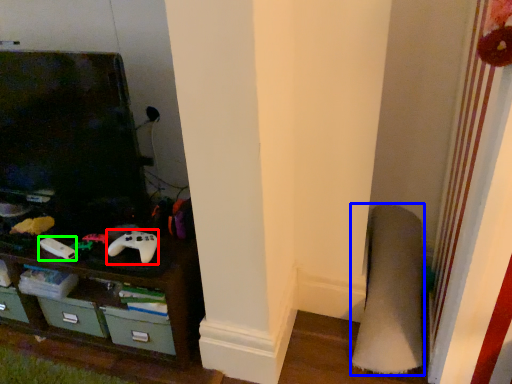
Question: Considering the real-world distances, which object is closest to game controller (highlighted by a red box)? plain (highlighted by a blue box) or game controller (highlighted by a green box).

Choices:
 (A) plain
 (B) game controller

Answer: (B)